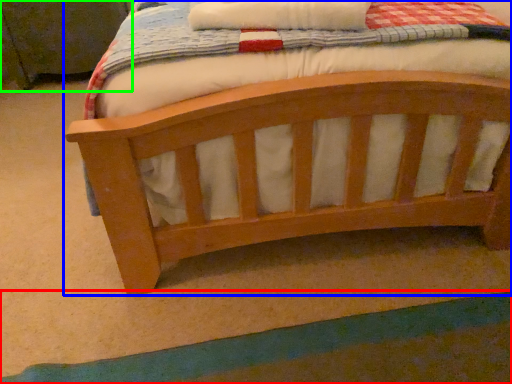
Question: Which object is positioned farthest from strip (highlighted by a red box)? Select from bed (highlighted by a blue box) and changing table (highlighted by a green box).

Choices:
 (A) bed
 (B) changing table

Answer: (B)